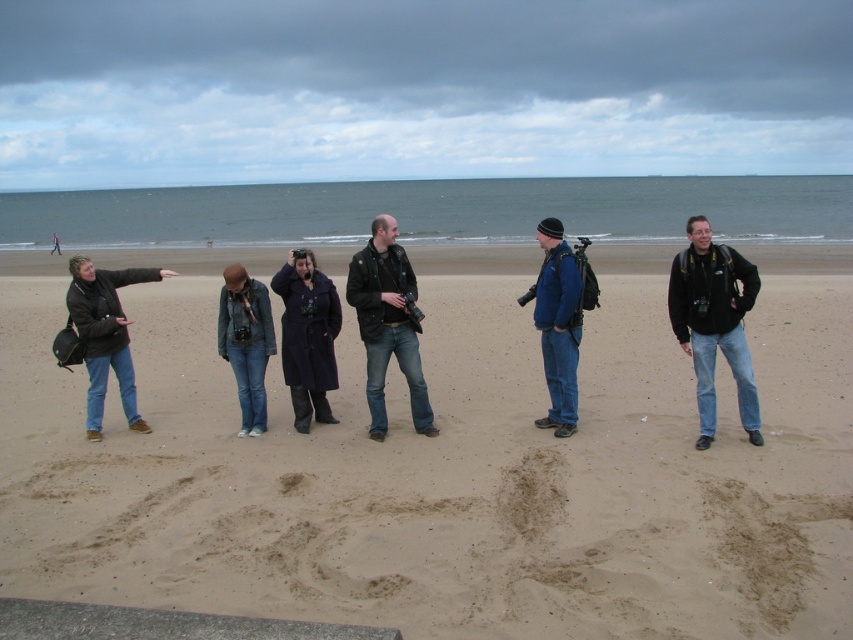
Question: Can you confirm if matte black jacket at center is bigger than denim jacket at center?

Choices:
 (A) no
 (B) yes

Answer: (A)

Question: Which point is closer to the camera?

Choices:
 (A) brown sand at center
 (B) purple wool coat at center

Answer: (A)

Question: Among these points, which one is nearest to the camera?

Choices:
 (A) (334, 324)
 (B) (248, 310)
 (C) (556, 403)
 (D) (415, 362)

Answer: (D)

Question: Is brown sand at center bigger than blue fabric jacket at center?

Choices:
 (A) yes
 (B) no

Answer: (A)

Question: Can you confirm if black matte jacket at center is bigger than blue fabric jacket at center?

Choices:
 (A) yes
 (B) no

Answer: (A)

Question: Which of the following is the closest to the observer?

Choices:
 (A) (743, 454)
 (B) (701, 224)
 (C) (378, 230)
 (D) (114, 371)

Answer: (B)